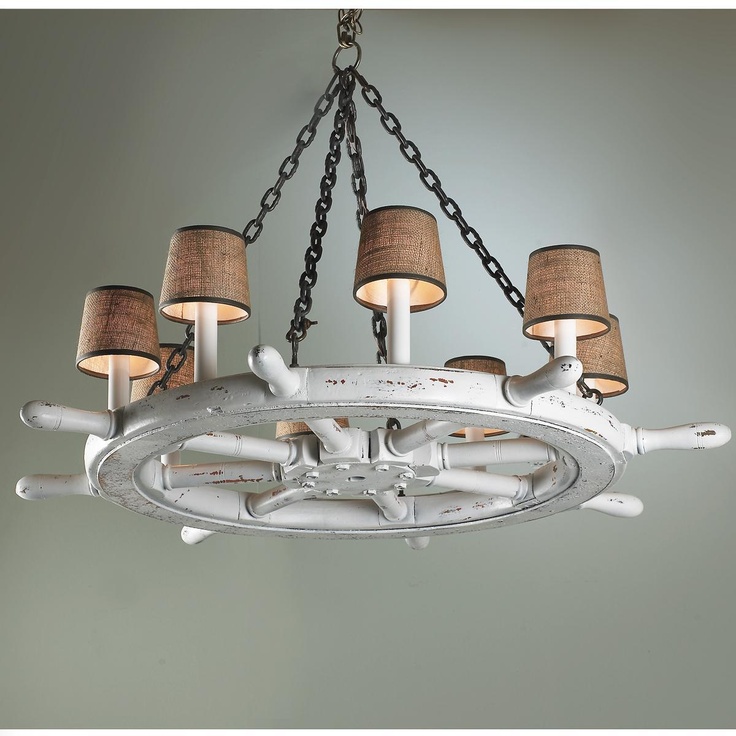
Find the location of a particular element. lampshade is located at coordinates (162, 353), (132, 343), (233, 283), (436, 269), (580, 286), (623, 350), (483, 363).